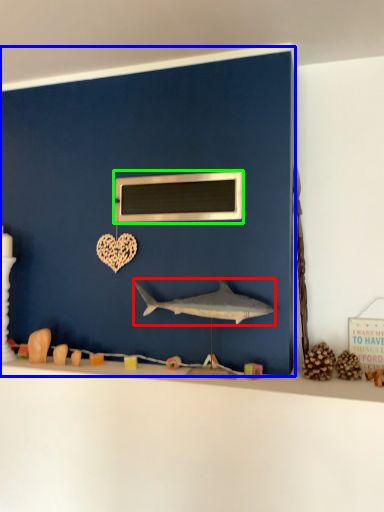
Question: Considering the real-world distances, which object is closest to shark (highlighted by a red box)? backdrop (highlighted by a blue box) or medicine cabinet (highlighted by a green box).

Choices:
 (A) backdrop
 (B) medicine cabinet

Answer: (B)